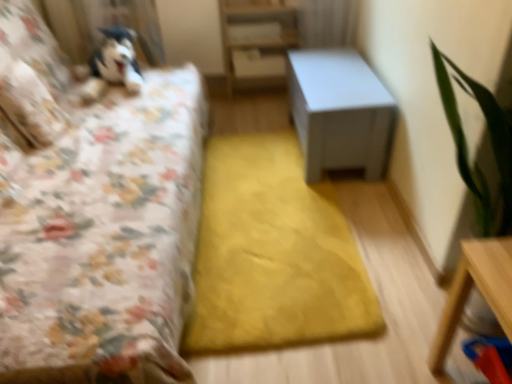
Find the location of a particular element. This screenshot has width=512, height=384. vacant region in front of white matte table at center, positioned as the first table in top-to-bottom order is located at coordinates (314, 210).